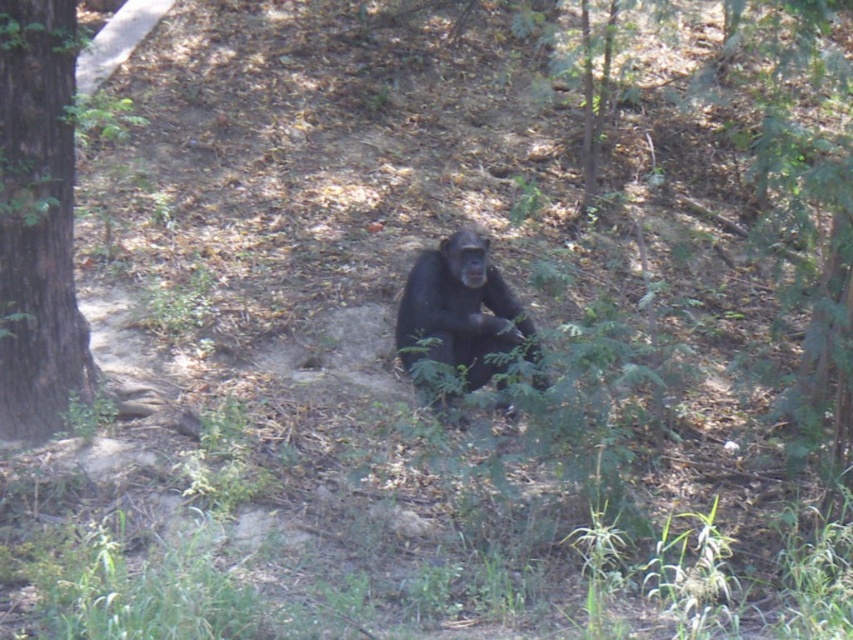
Consider the image. Is brown rough tree at left bigger than black fur monkey at center?

Indeed, brown rough tree at left has a larger size compared to black fur monkey at center.

Can you confirm if brown rough tree at left is positioned above black fur monkey at center?

Indeed, brown rough tree at left is positioned over black fur monkey at center.

The height and width of the screenshot is (640, 853). What are the coordinates of `brown rough tree at left` in the screenshot? It's located at (38, 221).

The width and height of the screenshot is (853, 640). Identify the location of brown rough tree at left. (38, 221).